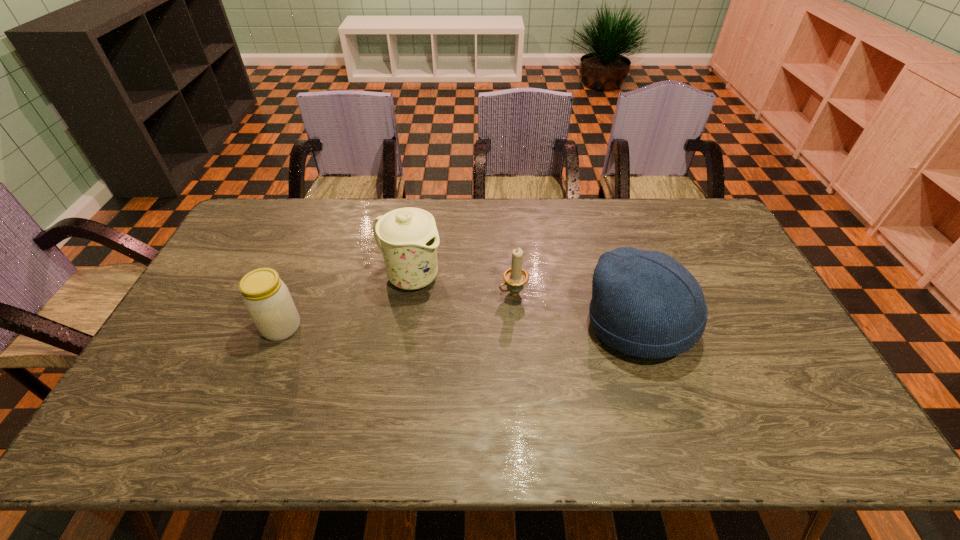
The width and height of the screenshot is (960, 540). I want to click on free space on the desktop that is between the jar and the skullcap and is positioned on the spout of the second object from left to right, so click(501, 327).

The image size is (960, 540). Identify the location of free space on the desktop that is between the jar and the skullcap and is positioned on the handle side of the second object from right to left. (437, 327).